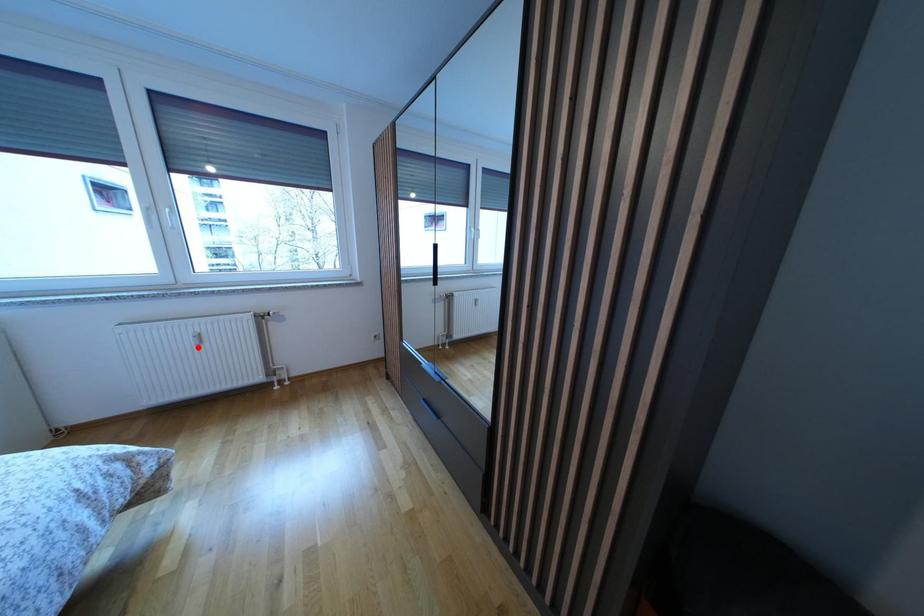
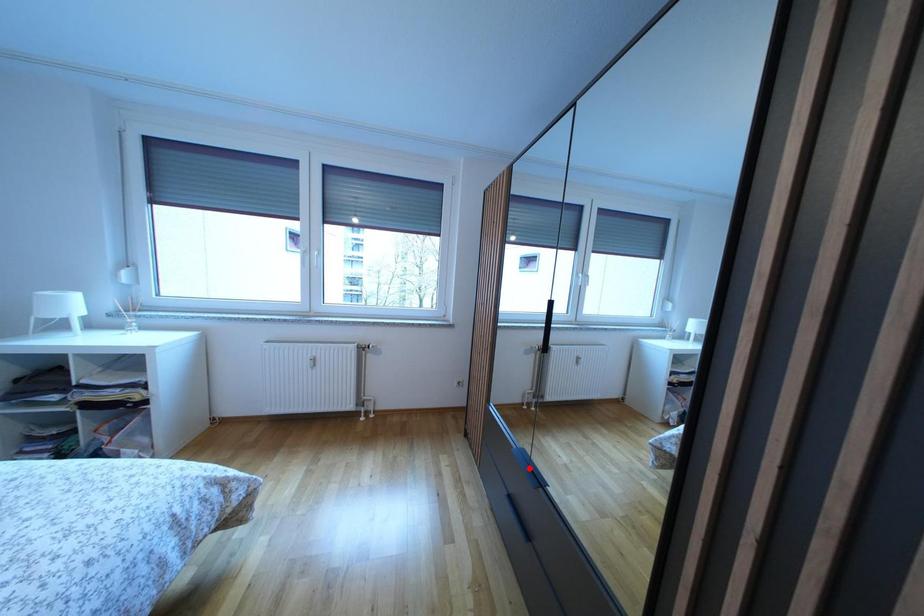
I am providing you with two images of the same scene from different viewpoints. A red point is marked on the first image and another point is marked on the second image. Do the highlighted points in image1 and image2 indicate the same real-world spot?

No